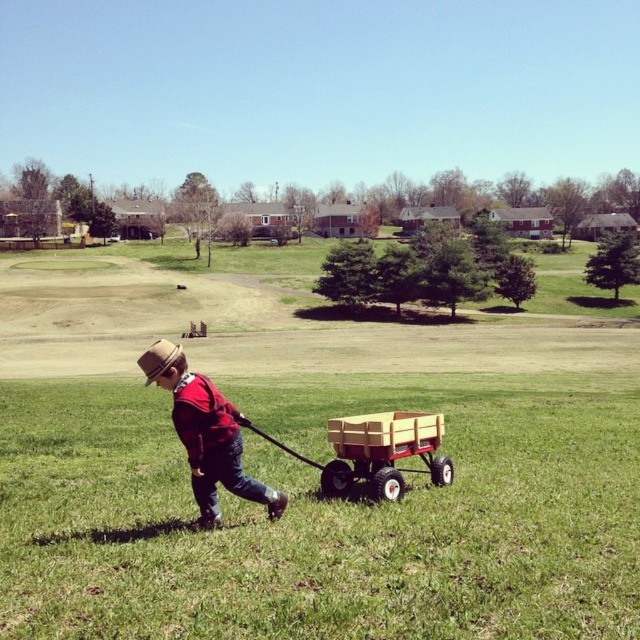
You are a photographer trying to capture the matte brown hat at center in your shot. You know its exact coordinates are at point 0.678, 0.322. If you adjust your camera to focus on the center of the image, which is point 0.5, 0.5, will the hat be slightly to the left or right of the center?

The matte brown hat at center is located at point (205, 433). Since the x coordinate 0.678 is greater than 0.5, it is slightly to the right of the center.